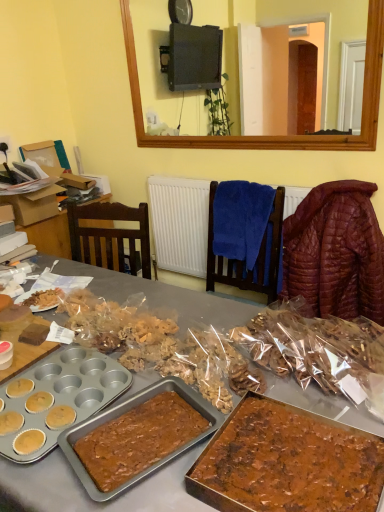
Question: Based on their positions, is translucent plastic bag at center, placed as the first snack when sorted from left to right, located to the left or right of quilted brown jacket at right?

Choices:
 (A) left
 (B) right

Answer: (A)

Question: Does point (107, 322) appear closer or farther from the camera than point (326, 198)?

Choices:
 (A) closer
 (B) farther

Answer: (A)

Question: Estimate the real-world distances between objects in this image. Which object is farther from the translucent plastic bag at center, positioned as the 2th snack in right-to-left order?

Choices:
 (A) chocolatey brown cake at lower right
 (B) cardboard box at left
 (C) quilted brown jacket at right
 (D) translucent plastic cookies at center, the second snack when ordered from left to right
 (E) blue fabric chair at center

Answer: (B)

Question: Which of these objects is positioned farthest from the chocolatey brown cake at lower right?

Choices:
 (A) quilted brown jacket at right
 (B) translucent plastic bag at center, placed as the first snack when sorted from left to right
 (C) translucent plastic cookies at center, arranged as the 1th snack when viewed from the right
 (D) blue fabric chair at center
 (E) cardboard box at left

Answer: (E)